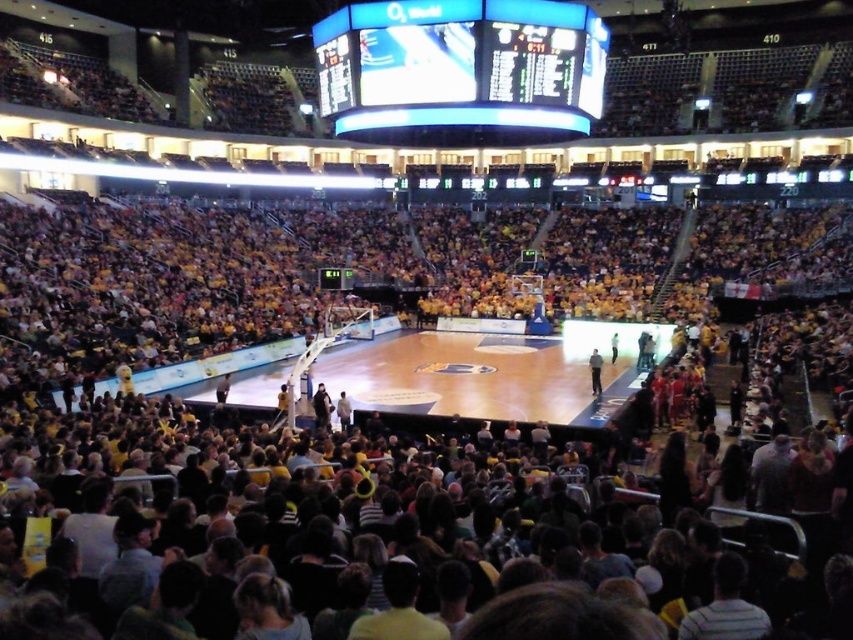
Who is taller, blue led scoreboard at center or wooden polished basketball court at center?

With more height is blue led scoreboard at center.

Describe the element at coordinates (460, 68) in the screenshot. I see `blue led scoreboard at center` at that location.

Is point (572, 68) positioned in front of point (608, 355)?

That is True.

This screenshot has width=853, height=640. What are the coordinates of `blue led scoreboard at center` in the screenshot? It's located at (460, 68).

Is point (593, 54) positioned after point (595, 355)?

No, it is in front of (595, 355).

Based on the photo, is the position of blue led scoreboard at center less distant than that of light blue jersey at center?

Yes.

Image resolution: width=853 pixels, height=640 pixels. I want to click on blue led scoreboard at center, so click(x=460, y=68).

Is wooden polished basketball court at center closer to camera compared to light blue jersey at center?

Yes, wooden polished basketball court at center is closer to the viewer.

Consider the image. Does wooden polished basketball court at center appear under light blue jersey at center?

No.

Identify the location of wooden polished basketball court at center. (488, 371).

Where is `wooden polished basketball court at center`? wooden polished basketball court at center is located at coordinates (488, 371).